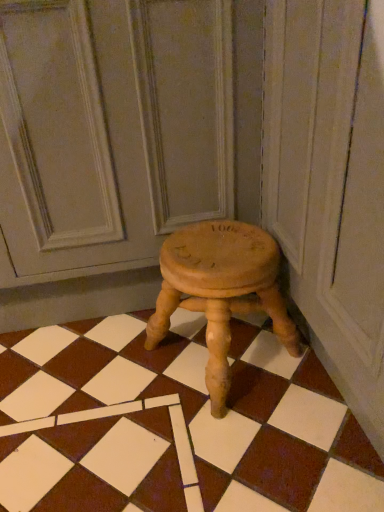
Question: Could you tell me if natural wood stool at center is turned towards wooden stool at center?

Choices:
 (A) no
 (B) yes

Answer: (A)

Question: From a real-world perspective, is natural wood stool at center under wooden stool at center?

Choices:
 (A) no
 (B) yes

Answer: (A)

Question: Considering the relative sizes of natural wood stool at center and wooden stool at center in the image provided, is natural wood stool at center wider than wooden stool at center?

Choices:
 (A) no
 (B) yes

Answer: (A)

Question: Considering the relative positions of natural wood stool at center and wooden stool at center in the image provided, is natural wood stool at center to the left of wooden stool at center from the viewer's perspective?

Choices:
 (A) yes
 (B) no

Answer: (A)

Question: Is wooden stool at center inside natural wood stool at center?

Choices:
 (A) yes
 (B) no

Answer: (B)

Question: Is point (301, 434) closer or farther from the camera than point (56, 17)?

Choices:
 (A) farther
 (B) closer

Answer: (A)

Question: From the image's perspective, relative to natural wood stool at center, is wooden stool at center above or below?

Choices:
 (A) above
 (B) below

Answer: (B)

Question: Looking at the image, does wooden stool at center seem bigger or smaller compared to natural wood stool at center?

Choices:
 (A) big
 (B) small

Answer: (B)

Question: Is wooden stool at center to the left or to the right of natural wood stool at center in the image?

Choices:
 (A) right
 (B) left

Answer: (A)

Question: Based on their sizes in the image, would you say natural wood stool at center is bigger or smaller than wooden stool at center?

Choices:
 (A) small
 (B) big

Answer: (B)

Question: Considering their positions, is natural wood stool at center located in front of or behind wooden stool at center?

Choices:
 (A) behind
 (B) front

Answer: (B)

Question: Considering the relative positions of natural wood stool at center and wooden stool at center in the image provided, is natural wood stool at center to the left or to the right of wooden stool at center?

Choices:
 (A) right
 (B) left

Answer: (B)

Question: In terms of width, does natural wood stool at center look wider or thinner when compared to wooden stool at center?

Choices:
 (A) wide
 (B) thin

Answer: (A)

Question: Considering the relative positions of wooden stool at center and wooden stool at center in the image provided, is wooden stool at center to the left or to the right of wooden stool at center?

Choices:
 (A) right
 (B) left

Answer: (B)

Question: Would you say wooden stool at center is inside or outside wooden stool at center?

Choices:
 (A) inside
 (B) outside

Answer: (B)